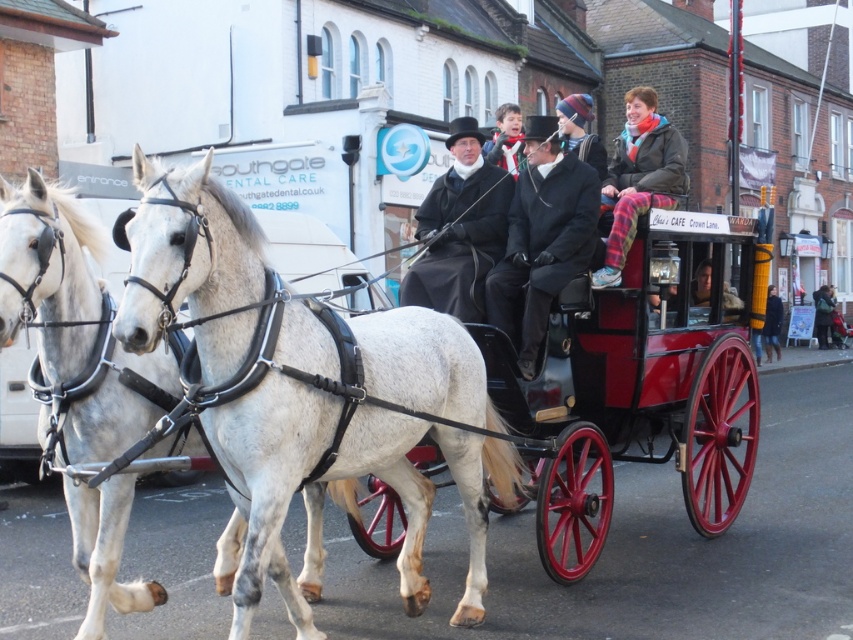
You are a photographer trying to capture the horses in the scene. You notice the white speckled fur at center and the multicolored knit hat at upper center. Which object has more layers visible in the photo?

The multicolored knit hat at upper center has more layers visible in the photo because it is thicker than the white speckled fur at center.

You are a tourist standing on the sidewalk observing the red polished wood horse cart at center and the white leather harness at left. Which object is positioned farther to the left?

The white leather harness at left is positioned farther to the left than the red polished wood horse cart at center.

You are a photographer trying to capture a photo of the white speckled fur at center and the multicolored knit hat at upper center in the scene. Based on their positions, which object should you focus on first if you want to include both in the frame without moving the camera?

The white speckled fur at center is positioned on the left side of multicolored knit hat at upper center, so you should focus on the white speckled fur at center first to ensure both are in the frame without moving the camera.